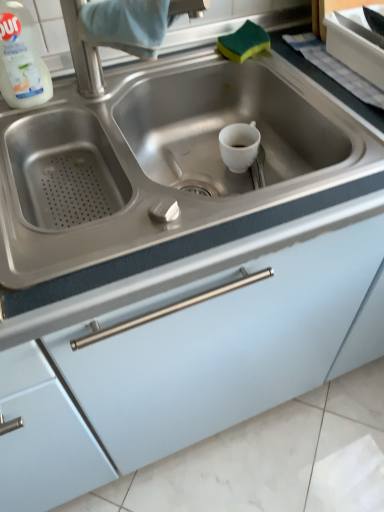
Question: From a real-world perspective, is matte white cabinet at center on top of stainless steel sink at center?

Choices:
 (A) yes
 (B) no

Answer: (B)

Question: Is matte white cabinet at center positioned beyond the bounds of stainless steel sink at center?

Choices:
 (A) yes
 (B) no

Answer: (A)

Question: Is matte white cabinet at center smaller than stainless steel sink at center?

Choices:
 (A) no
 (B) yes

Answer: (A)

Question: Can you confirm if matte white cabinet at center is shorter than stainless steel sink at center?

Choices:
 (A) yes
 (B) no

Answer: (B)

Question: From a real-world perspective, is matte white cabinet at center below stainless steel sink at center?

Choices:
 (A) yes
 (B) no

Answer: (A)

Question: Is matte white cabinet at center further to the viewer compared to stainless steel sink at center?

Choices:
 (A) yes
 (B) no

Answer: (B)

Question: From a real-world perspective, is white plastic bottle at upper left on top of stainless steel sink at center?

Choices:
 (A) no
 (B) yes

Answer: (B)

Question: Is there a large distance between white plastic bottle at upper left and stainless steel sink at center?

Choices:
 (A) yes
 (B) no

Answer: (B)

Question: From the image's perspective, is white plastic bottle at upper left located beneath stainless steel sink at center?

Choices:
 (A) yes
 (B) no

Answer: (B)

Question: Is white plastic bottle at upper left oriented towards stainless steel sink at center?

Choices:
 (A) yes
 (B) no

Answer: (B)

Question: Is white plastic bottle at upper left outside stainless steel sink at center?

Choices:
 (A) yes
 (B) no

Answer: (A)

Question: Can you confirm if white plastic bottle at upper left is taller than stainless steel sink at center?

Choices:
 (A) yes
 (B) no

Answer: (B)

Question: Can you confirm if stainless steel sink at center is wider than stainless steel faucet at upper center?

Choices:
 (A) yes
 (B) no

Answer: (A)